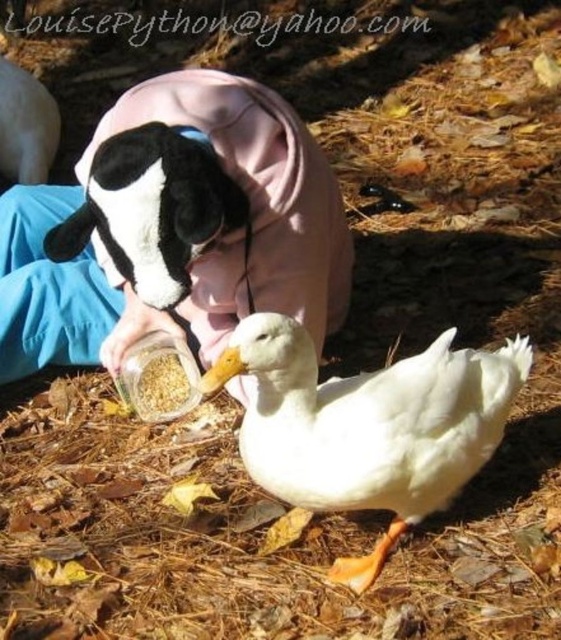
The image size is (561, 640). What do you see at coordinates (154, 209) in the screenshot?
I see `soft plush toy at center` at bounding box center [154, 209].

Who is higher up, soft plush toy at center or brown grain at center?

Positioned higher is soft plush toy at center.

Does point (107, 184) lie behind point (128, 385)?

No.

At what (x,y) coordinates should I click in order to perform the action: click on soft plush toy at center. Please return your answer as a coordinate pair (x, y). Looking at the image, I should click on (154, 209).

Is point (245, 330) less distant than point (38, 118)?

Yes, it is in front of point (38, 118).

Is white matte duck at center bigger than black plush toy at upper left?

Yes.

The image size is (561, 640). What do you see at coordinates (367, 426) in the screenshot?
I see `white matte duck at center` at bounding box center [367, 426].

The image size is (561, 640). I want to click on white matte duck at center, so click(x=367, y=426).

From the picture: Is white matte duck at center bigger than soft plush toy at center?

Correct, white matte duck at center is larger in size than soft plush toy at center.

Between white matte duck at center and soft plush toy at center, which one is positioned higher?

soft plush toy at center is above.

Who is more forward, (x=426, y=422) or (x=112, y=172)?

Positioned in front is point (x=426, y=422).

You are a GUI agent. You are given a task and a screenshot of the screen. Output one action in this format:
    pyautogui.click(x=<x>, y=<y>)
    Task: Click on the white matte duck at center
    This screenshot has width=561, height=640.
    Given the screenshot: What is the action you would take?
    pyautogui.click(x=367, y=426)